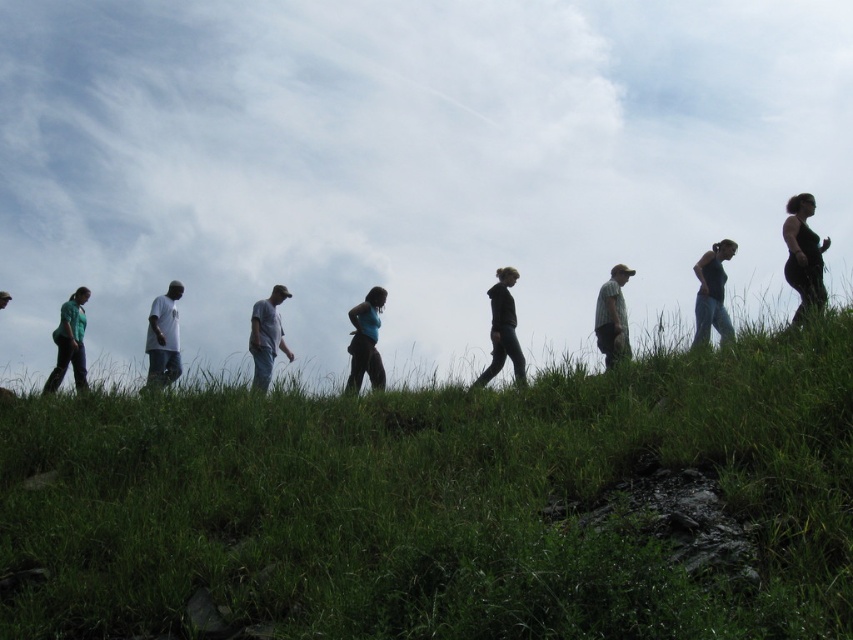
Does blue fabric pants at center appear under light gray cotton shirt at center?

No.

Can you confirm if blue fabric pants at center is bigger than light gray cotton shirt at center?

Indeed, blue fabric pants at center has a larger size compared to light gray cotton shirt at center.

Who is more distant from viewer, (354, 307) or (287, 358)?

Point (287, 358)

Identify the location of blue fabric pants at center. (364, 340).

This screenshot has width=853, height=640. What do you see at coordinates (503, 330) in the screenshot?
I see `dark green fabric pants at center` at bounding box center [503, 330].

Is dark green fabric pants at center to the right of green fabric shirt at left from the viewer's perspective?

Indeed, dark green fabric pants at center is positioned on the right side of green fabric shirt at left.

Locate an element on the screen. dark green fabric pants at center is located at coordinates (503, 330).

Is black matte dress at right thinner than blue fabric pants at center?

No.

Looking at this image, how far apart are black matte dress at right and blue fabric pants at center?

black matte dress at right is 7.61 meters from blue fabric pants at center.

Locate an element on the screen. Image resolution: width=853 pixels, height=640 pixels. black matte dress at right is located at coordinates (804, 257).